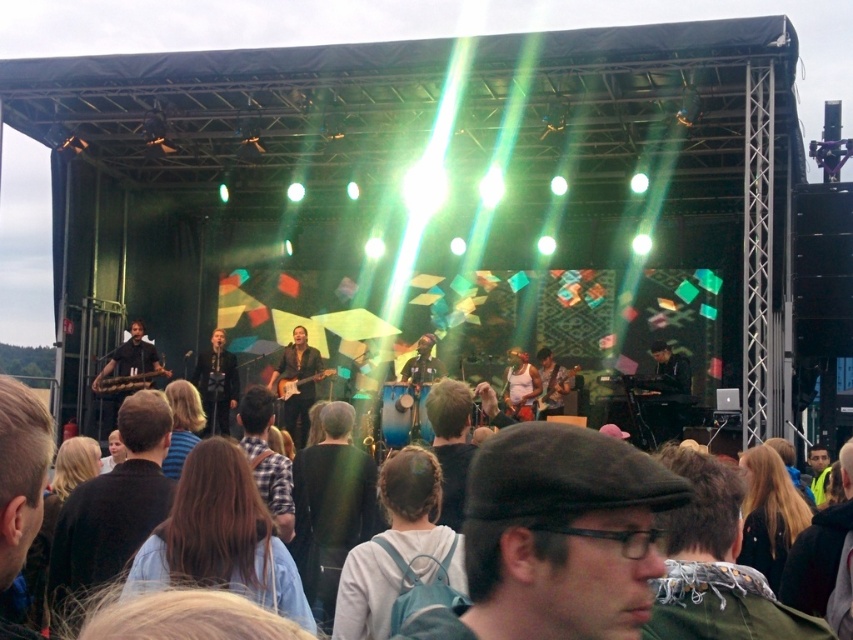
You are a photographer at the concert and want to capture both the matte black shirt at center and the white matte tank top at center in a single photo. Which one is positioned higher in the frame?

The matte black shirt at center is above the white matte tank top at center, so it is positioned higher in the frame.

You are a photographer at the concert and want to capture both the matte black shirt at center and the white matte tank top at center in a single frame. Which direction should you adjust your camera to include both?

The matte black shirt at center is to the left of the white matte tank top at center, so you should pan your camera slightly to the left to include both in the frame.